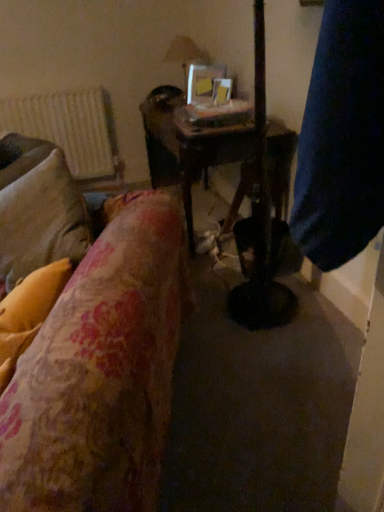
Question: Is clear glass lampshade at upper center shorter than white textured radiator at upper left?

Choices:
 (A) yes
 (B) no

Answer: (A)

Question: Is white textured radiator at upper left completely or partially inside clear glass lampshade at upper center?

Choices:
 (A) yes
 (B) no

Answer: (B)

Question: From the image's perspective, is clear glass lampshade at upper center below white textured radiator at upper left?

Choices:
 (A) yes
 (B) no

Answer: (B)

Question: From the image's perspective, would you say clear glass lampshade at upper center is positioned over white textured radiator at upper left?

Choices:
 (A) yes
 (B) no

Answer: (A)

Question: Does clear glass lampshade at upper center come behind white textured radiator at upper left?

Choices:
 (A) yes
 (B) no

Answer: (B)

Question: Could you tell me if clear glass lampshade at upper center is turned towards white textured radiator at upper left?

Choices:
 (A) yes
 (B) no

Answer: (A)

Question: Is floral fabric pillow at left facing towards white textured radiator at upper left?

Choices:
 (A) no
 (B) yes

Answer: (A)

Question: Can you confirm if floral fabric pillow at left is thinner than white textured radiator at upper left?

Choices:
 (A) no
 (B) yes

Answer: (A)

Question: Is the depth of floral fabric pillow at left less than that of white textured radiator at upper left?

Choices:
 (A) no
 (B) yes

Answer: (B)

Question: Considering the relative sizes of floral fabric pillow at left and white textured radiator at upper left in the image provided, is floral fabric pillow at left taller than white textured radiator at upper left?

Choices:
 (A) no
 (B) yes

Answer: (A)

Question: Considering the relative positions of floral fabric pillow at left and white textured radiator at upper left in the image provided, is floral fabric pillow at left behind white textured radiator at upper left?

Choices:
 (A) no
 (B) yes

Answer: (A)

Question: Are floral fabric pillow at left and white textured radiator at upper left located far from each other?

Choices:
 (A) yes
 (B) no

Answer: (A)

Question: Is floral fabric pillow at left to the left of wooden table at center from the viewer's perspective?

Choices:
 (A) yes
 (B) no

Answer: (A)